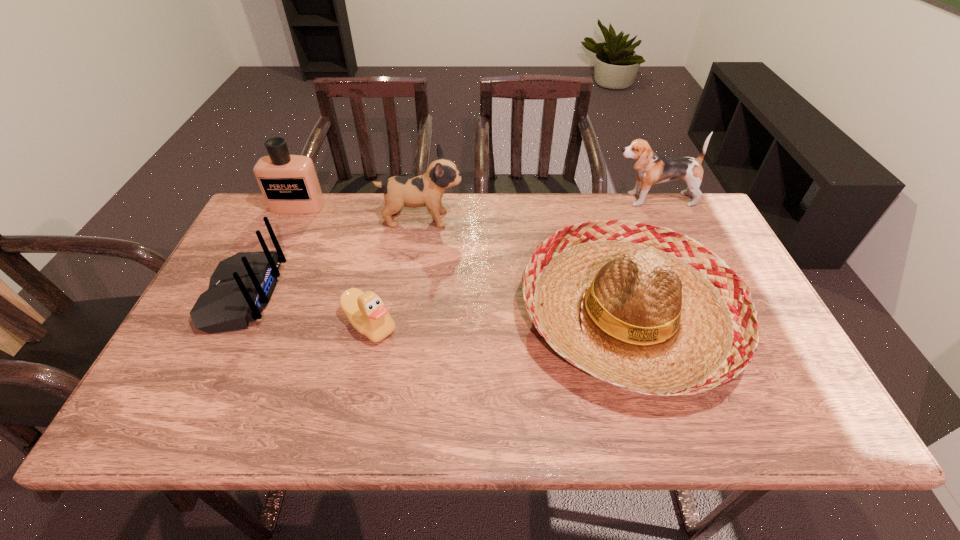
Locate an element on the screen. object that is positioned at the far left corner is located at coordinates (289, 183).

At what (x,y) coordinates should I click in order to perform the action: click on object that is at the far right corner. Please return your answer as a coordinate pair (x, y). This screenshot has width=960, height=540. Looking at the image, I should click on (652, 168).

Where is `object positioned at the near right corner`? This screenshot has width=960, height=540. object positioned at the near right corner is located at coordinates (644, 308).

The width and height of the screenshot is (960, 540). Identify the location of vacant space at the far edge of the desktop. (348, 196).

I want to click on free location at the near edge, so click(227, 416).

This screenshot has width=960, height=540. In the image, there is a desktop. Find the location of `vacant space at the left edge`. vacant space at the left edge is located at coordinates (229, 256).

Locate an element on the screen. free space at the right edge of the desktop is located at coordinates pos(731,264).

Locate an element on the screen. vacant space at the far right corner of the desktop is located at coordinates (680, 228).

Where is `vacant area that lies between the perfume and the nearer puppy`? The width and height of the screenshot is (960, 540). vacant area that lies between the perfume and the nearer puppy is located at coordinates pyautogui.click(x=360, y=213).

Where is `vacant area that lies between the perfume and the router`? This screenshot has height=540, width=960. vacant area that lies between the perfume and the router is located at coordinates (271, 251).